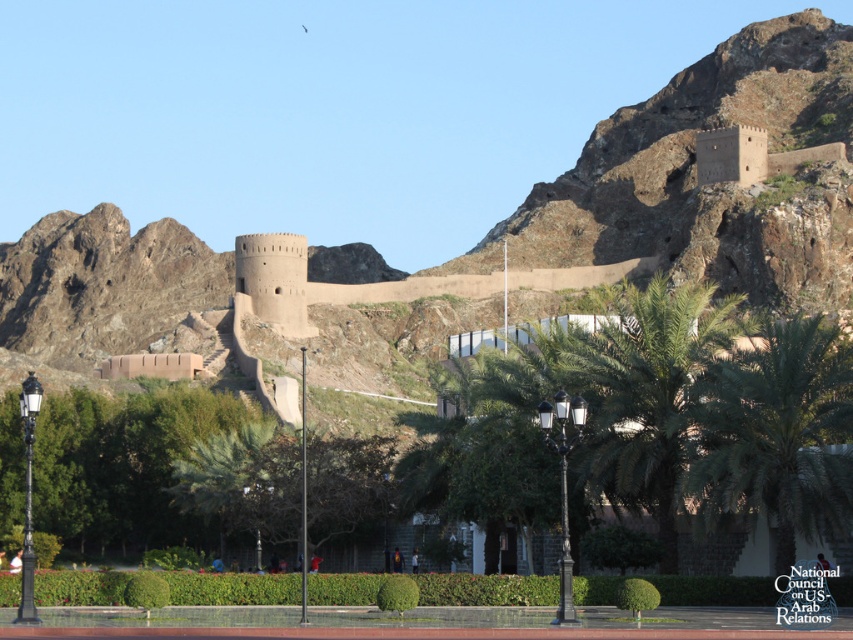
You are standing at the entrance of the fortification and want to take a photo of the green leafy palm tree at center. Where should you position yourself to capture it in the frame?

The green leafy palm tree at center is located at point (x=776, y=435), so you should position yourself at the entrance and aim your camera towards the center area to capture it in the frame.